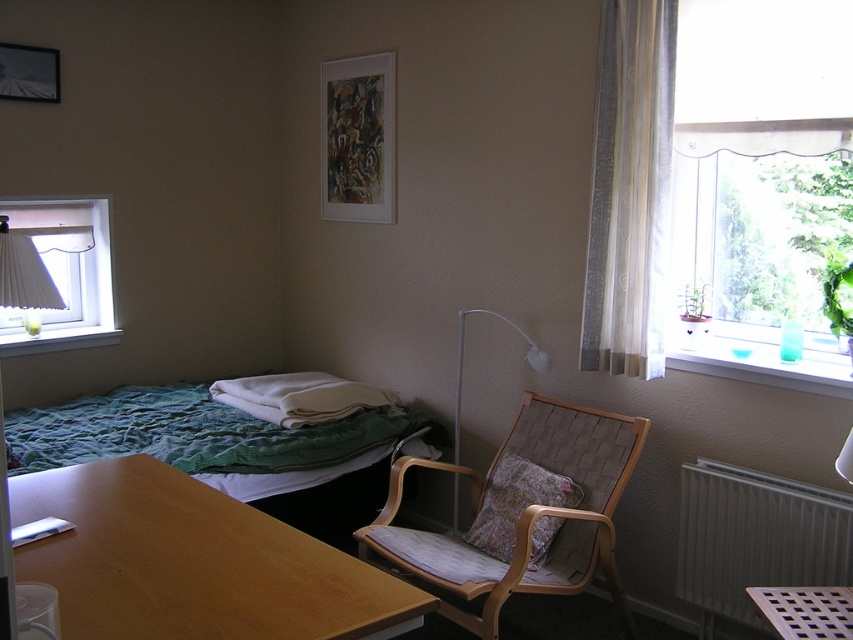
Who is shorter, light brown woven fabric rocking chair at center or white pleated curtain at left?

white pleated curtain at left is shorter.

Is light brown woven fabric rocking chair at center further to camera compared to white pleated curtain at left?

No.

You are a GUI agent. You are given a task and a screenshot of the screen. Output one action in this format:
    pyautogui.click(x=<x>, y=<y>)
    Task: Click on the light brown woven fabric rocking chair at center
    The width and height of the screenshot is (853, 640).
    Given the screenshot: What is the action you would take?
    pyautogui.click(x=525, y=515)

Who is higher up, transparent glass window at upper right or matte white lampshade at left?

transparent glass window at upper right is higher up.

Describe the element at coordinates (762, 182) in the screenshot. I see `transparent glass window at upper right` at that location.

Locate an element on the screen. The height and width of the screenshot is (640, 853). transparent glass window at upper right is located at coordinates (762, 182).

Is sheer white curtain at upper right taller than light brown woven fabric rocking chair at center?

Yes, sheer white curtain at upper right is taller than light brown woven fabric rocking chair at center.

Between point (614, 317) and point (556, 470), which one is positioned behind?

The point (556, 470) is more distant.

Does point (614, 230) lie behind point (605, 477)?

Yes, point (614, 230) is behind point (605, 477).

This screenshot has width=853, height=640. What are the coordinates of `sheer white curtain at upper right` in the screenshot? It's located at (630, 189).